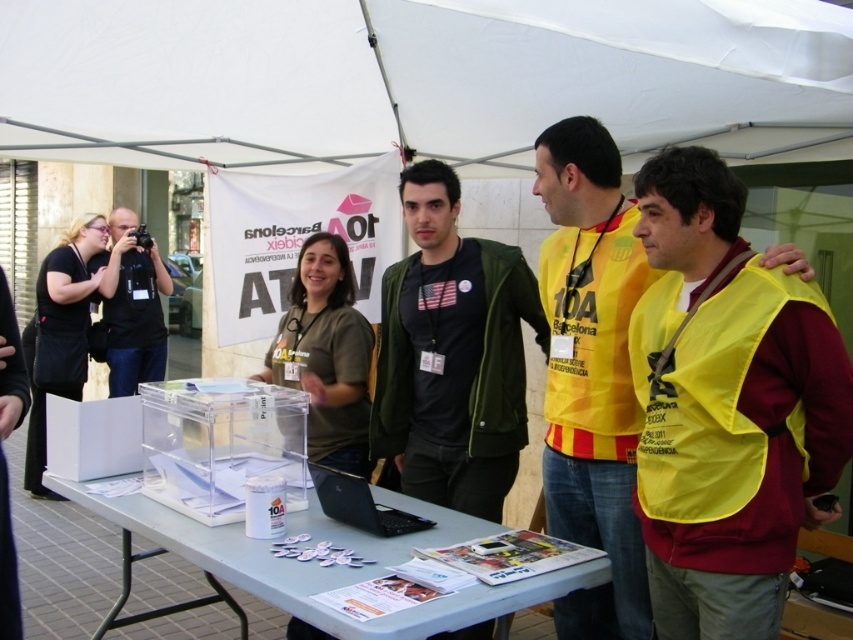
Question: Does dark green jacket at center have a greater width compared to green fabric shirt at center?

Choices:
 (A) no
 (B) yes

Answer: (B)

Question: Can you confirm if white fabric canopy at upper center is positioned to the left of clear plastic table at center?

Choices:
 (A) yes
 (B) no

Answer: (B)

Question: Is yellow fabric vest at center thinner than black fabric apron at left?

Choices:
 (A) yes
 (B) no

Answer: (A)

Question: Which point is closer to the camera taking this photo?

Choices:
 (A) click(x=383, y=513)
 (B) click(x=422, y=339)

Answer: (A)

Question: Which of these objects is positioned closest to the dark green jacket at center?

Choices:
 (A) yellow fabric vest at center
 (B) black fabric apron at left
 (C) white fabric canopy at upper center

Answer: (A)

Question: Which point is farther to the camera?

Choices:
 (A) (195, 545)
 (B) (585, 300)
 (C) (364, 486)
 (D) (354, 460)

Answer: (D)